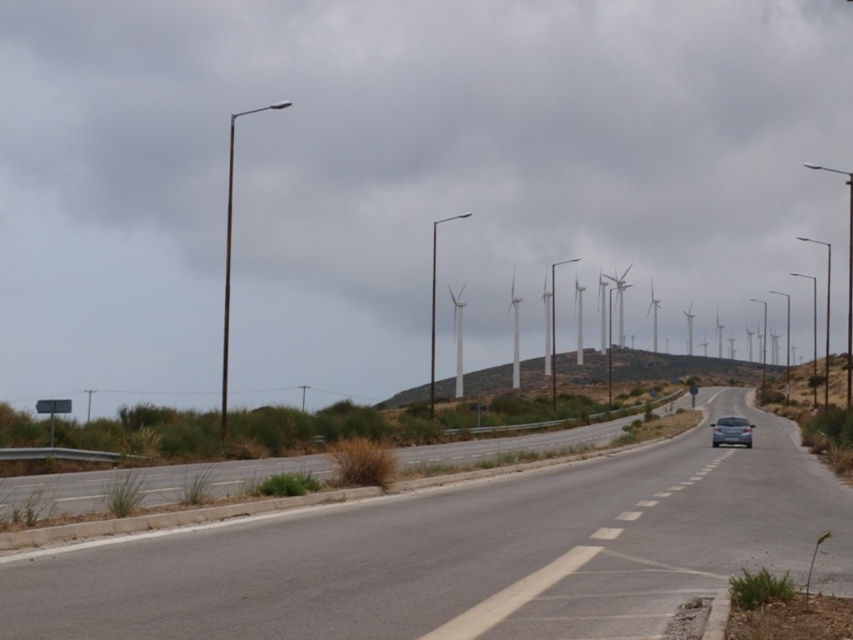
Is asphalt road at center shorter than satin silver sedan at center-right?

In fact, asphalt road at center may be taller than satin silver sedan at center-right.

Is point (436, 547) in front of point (721, 433)?

Yes, it is in front of point (721, 433).

Does point (844, 573) come farther from viewer compared to point (715, 422)?

No.

I want to click on asphalt road at center, so click(x=465, y=554).